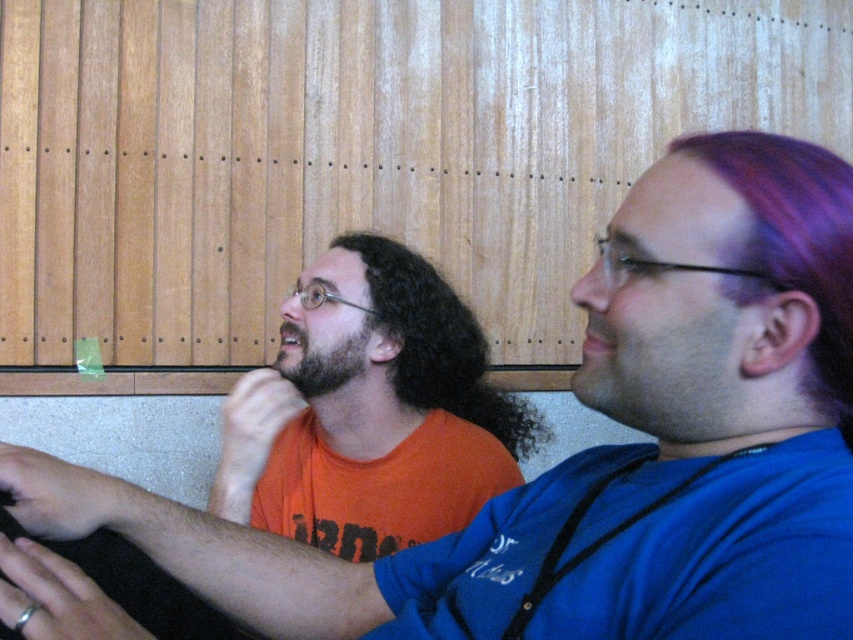
Question: Based on their relative distances, which object is nearer to the dark brown fuzzy beard at center?

Choices:
 (A) curly brown hair at center
 (B) purple dyed hair at right

Answer: (A)

Question: Is orange t-shirt at center closer to the viewer compared to purple dyed hair at right?

Choices:
 (A) yes
 (B) no

Answer: (B)

Question: Does curly brown hair at center appear over dark brown fuzzy beard at center?

Choices:
 (A) no
 (B) yes

Answer: (A)

Question: Which point appears closest to the camera in this image?

Choices:
 (A) (363, 328)
 (B) (294, 368)
 (C) (815, 348)
 (D) (384, 278)

Answer: (C)

Question: Can you confirm if orange t-shirt at center is bigger than curly brown hair at center?

Choices:
 (A) yes
 (B) no

Answer: (B)

Question: Which is farther from the curly brown hair at center?

Choices:
 (A) dark brown fuzzy beard at center
 (B) orange t-shirt at center

Answer: (A)